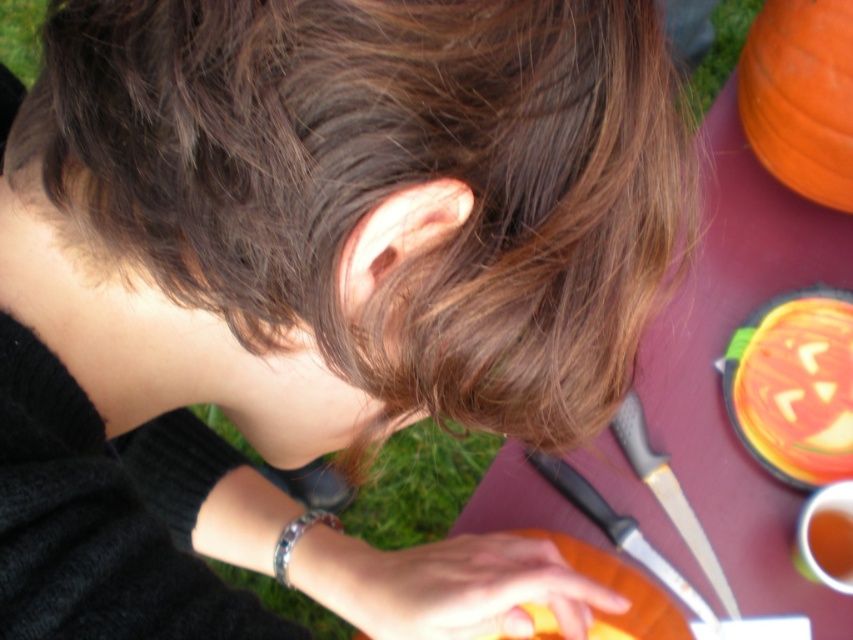
From the picture: Is orange carved pumpkin at lower right further to camera compared to orange matte pumpkin at lower center?

Yes, it is.

Does point (820, 285) come farther from viewer compared to point (595, 576)?

Yes, it is.

Identify the location of orange carved pumpkin at lower right. The width and height of the screenshot is (853, 640). (793, 385).

Does point (825, 408) come farther from viewer compared to point (824, 83)?

Yes.

Can you confirm if orange carved pumpkin at lower right is taller than orange matte pumpkin at upper right?

In fact, orange carved pumpkin at lower right may be shorter than orange matte pumpkin at upper right.

Locate an element on the screen. orange carved pumpkin at lower right is located at coordinates (793, 385).

Can you confirm if orange matte pumpkin at upper right is positioned to the right of orange matte pumpkin at lower center?

Indeed, orange matte pumpkin at upper right is positioned on the right side of orange matte pumpkin at lower center.

Is point (814, 97) farther from camera compared to point (548, 532)?

No, (814, 97) is closer to viewer.

Does point (840, 188) come in front of point (550, 536)?

No.

The width and height of the screenshot is (853, 640). In order to click on orange matte pumpkin at upper right in this screenshot , I will do `click(799, 97)`.